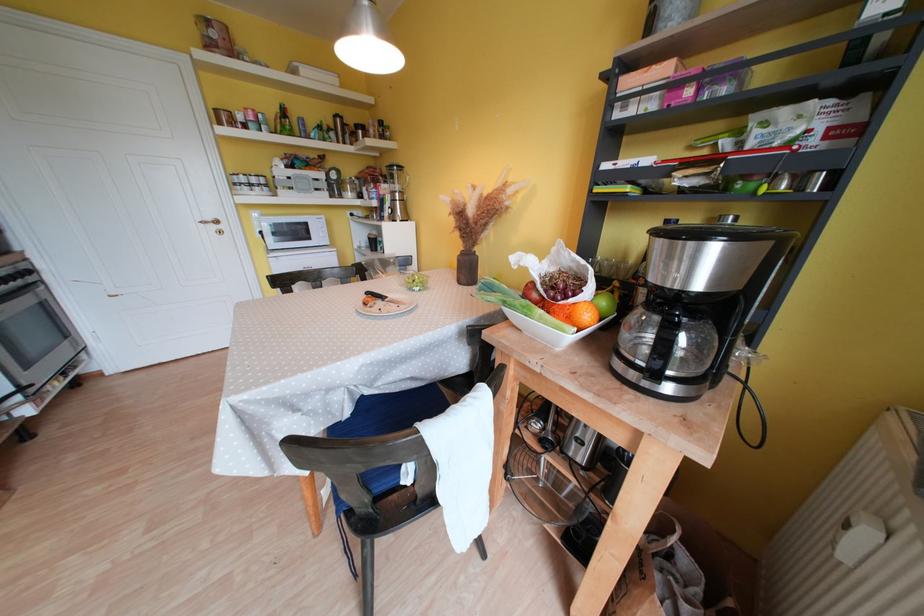
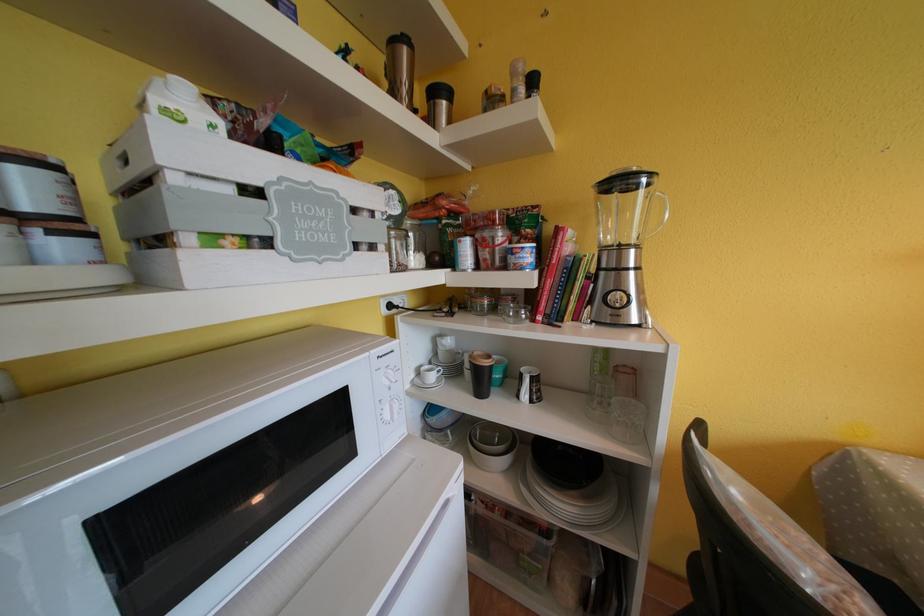
The point at (342, 120) is marked in the first image. Where is the corresponding point in the second image?

(399, 46)